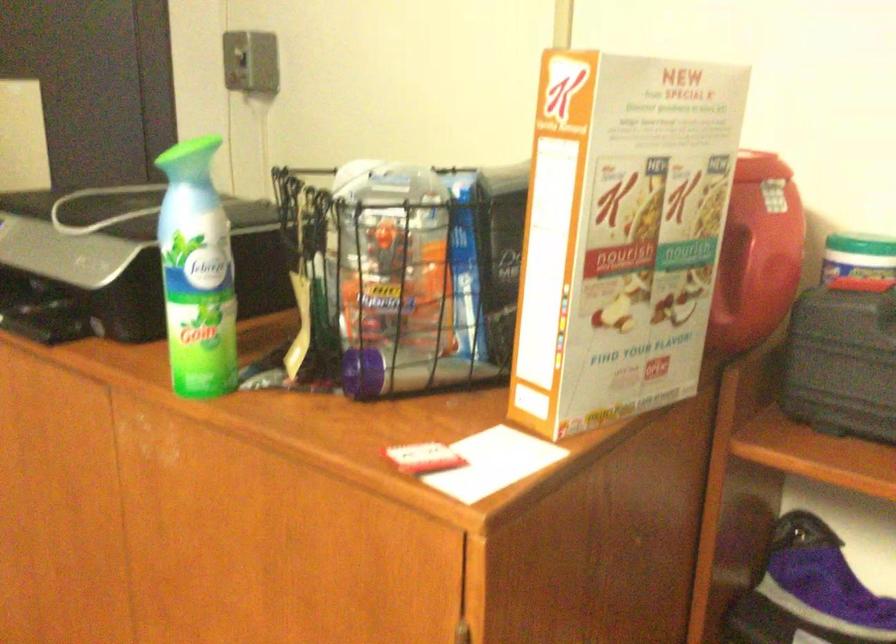
You are a GUI agent. You are given a task and a screenshot of the screen. Output one action in this format:
    pyautogui.click(x=<x>, y=<y>)
    Task: Click on the green spray trigger
    
    Given the screenshot: What is the action you would take?
    pyautogui.click(x=194, y=147)